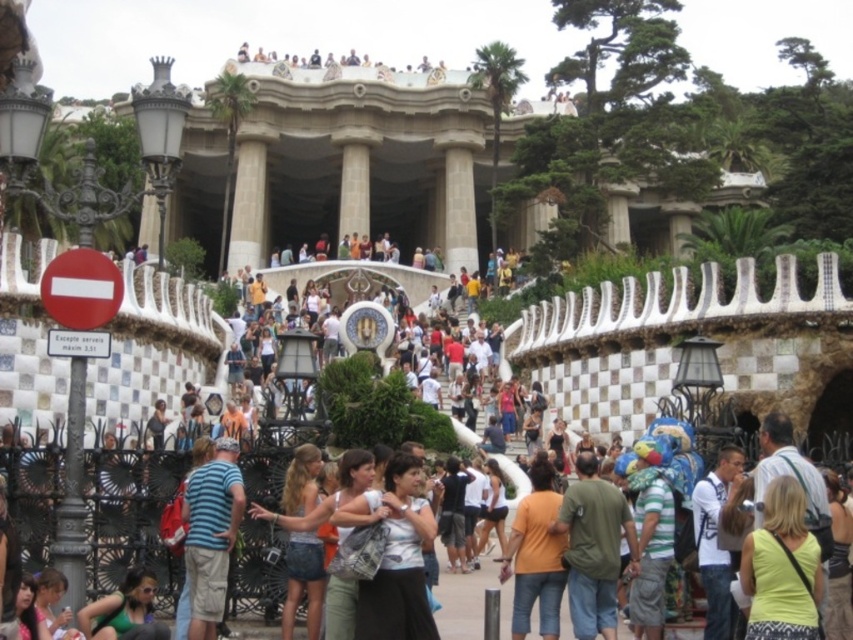
You are a photographer trying to capture a clear shot of the yellow fabric top at center and the matte black hair at lower left. Which object is located above the other in the scene?

The yellow fabric top at center is positioned over matte black hair at lower left.

You are standing at the point labeled point (26, 593) in the image. You want to walk to the point labeled point (804, 625). Which direction should you move relative to your current position?

You should move forward because point (804, 625) is behind point (26, 593), meaning it is in the direction you are facing as you look away from the image.